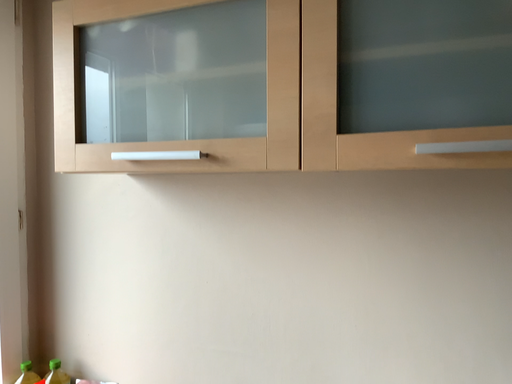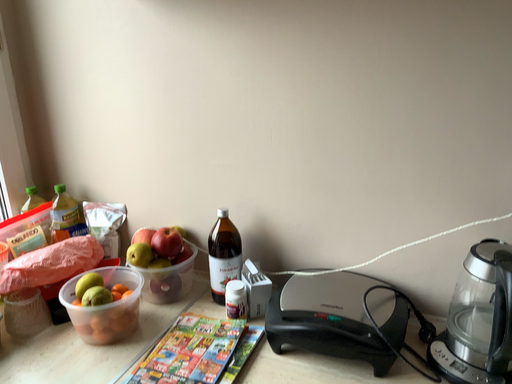
Question: How did the camera likely rotate when shooting the video?

Choices:
 (A) rotated downward
 (B) rotated upward

Answer: (A)